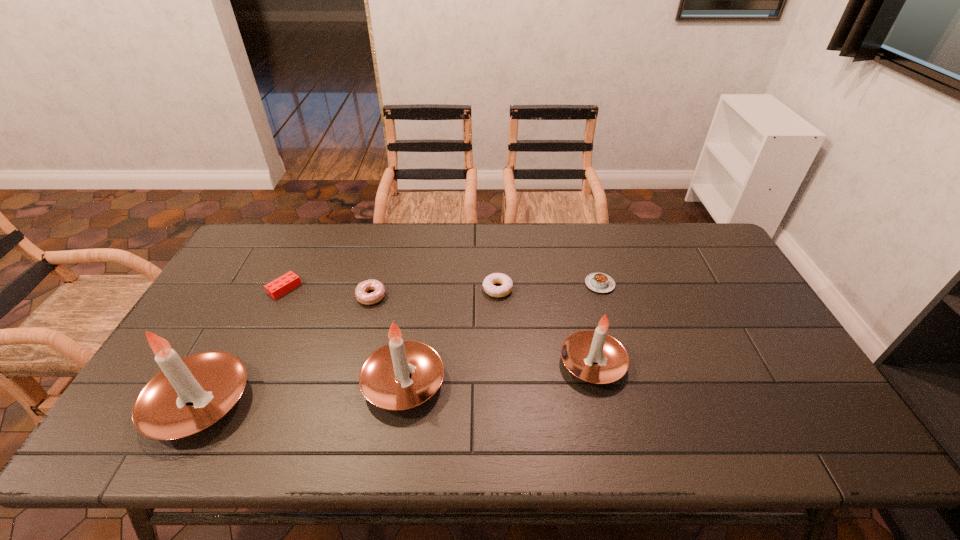
The height and width of the screenshot is (540, 960). In order to click on free space located on the right of the second candle from left to right in this screenshot , I will do coord(508,382).

I want to click on free spot located on the right of the rightmost candle, so click(683, 363).

This screenshot has height=540, width=960. I want to click on free point located 0.220m on the back of the Lego, so click(x=309, y=236).

Identify the location of vacant point located 0.060m on the right of the third object from right to left. (532, 289).

The height and width of the screenshot is (540, 960). I want to click on vacant area situated on the front of the left doughnut, so click(x=350, y=377).

Find the location of a particular element. Image resolution: width=960 pixels, height=540 pixels. vacant space located 0.210m on the front of the pudding is located at coordinates (618, 348).

What are the coordinates of `object situated at the left edge` in the screenshot? It's located at (189, 394).

The height and width of the screenshot is (540, 960). I want to click on object that is at the near left corner, so click(x=189, y=394).

Find the location of a particular element. free location at the far edge of the desktop is located at coordinates (364, 254).

The height and width of the screenshot is (540, 960). What are the coordinates of `free region at the near edge of the desktop` in the screenshot? It's located at (631, 393).